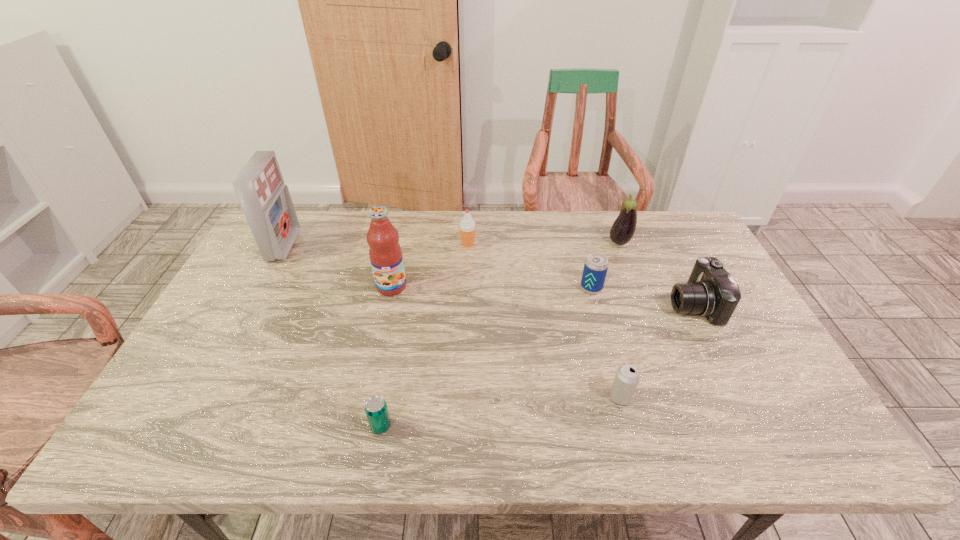
Where is `the first-aid kit at the far edge`? Image resolution: width=960 pixels, height=540 pixels. the first-aid kit at the far edge is located at coordinates (266, 202).

Locate an element on the screen. eggplant present at the far edge is located at coordinates (622, 231).

I want to click on icecream that is at the far edge, so click(467, 228).

Locate an element on the screen. The height and width of the screenshot is (540, 960). object at the near edge is located at coordinates (376, 409).

The image size is (960, 540). I want to click on object that is at the left edge, so click(266, 202).

I want to click on object that is at the right edge, so click(x=711, y=291).

What are the coordinates of `object located in the far left corner section of the desktop` in the screenshot? It's located at (x=266, y=202).

Image resolution: width=960 pixels, height=540 pixels. Identify the location of vacant space at the far edge of the desktop. (399, 223).

In the image, there is a desktop. Where is `vacant space at the near edge`? vacant space at the near edge is located at coordinates (666, 431).

Identify the location of blank space at the left edge of the desktop. This screenshot has height=540, width=960. (180, 366).